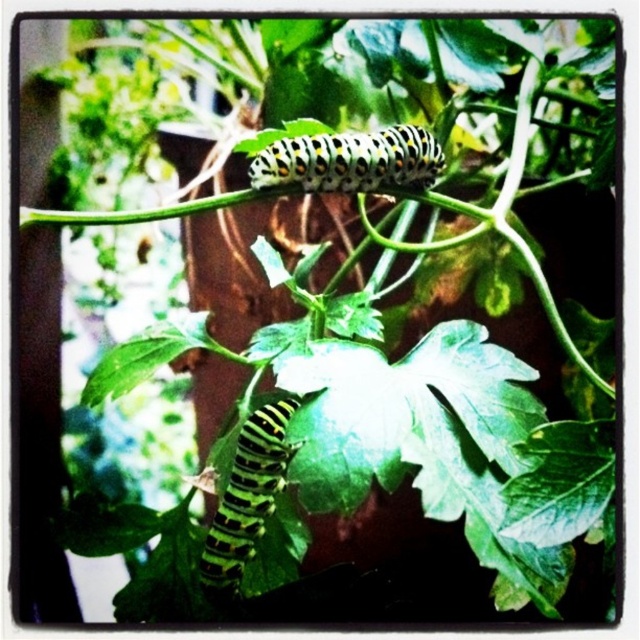
You are a gardener observing two caterpillars on a plant. You see the green and black spotted caterpillar at upper center and the black striped caterpillar at lower left. Which caterpillar is located to the right of the other?

The green and black spotted caterpillar at upper center is positioned on the right side of black striped caterpillar at lower left.

You are a photographer trying to capture a close shot of two caterpillars on a plant. You notice two points of interest marked at coordinates point (x=416, y=160) and point (x=243, y=452). If you want to focus on the caterpillar that is closer to you, which point should you aim your camera at?

Point (x=416, y=160) is further to the viewer than point (x=243, y=452). Therefore, to focus on the caterpillar closer to you, aim your camera at point (x=416, y=160).